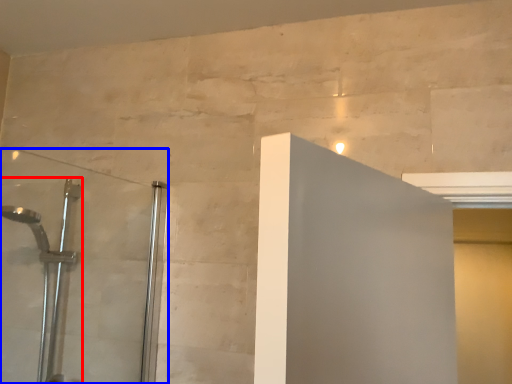
Question: Which object appears farthest to the camera in this image, shower (highlighted by a red box) or shower door (highlighted by a blue box)?

Choices:
 (A) shower
 (B) shower door

Answer: (A)